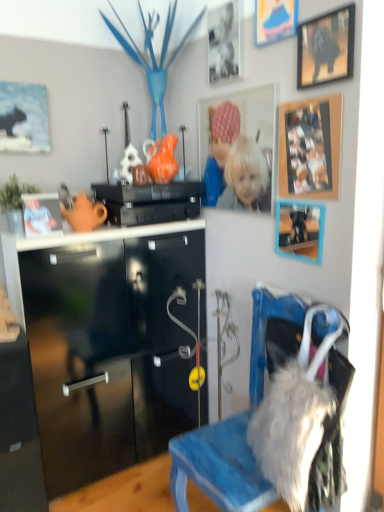
Question: Could you tell me if blue denim chair at lower right is turned towards wooden photo frame at upper center, marked as the fourth picture frame in a right-to-left arrangement?

Choices:
 (A) yes
 (B) no

Answer: (B)

Question: Would you say blue denim chair at lower right contains wooden photo frame at upper center, marked as the fourth picture frame in a right-to-left arrangement?

Choices:
 (A) yes
 (B) no

Answer: (B)

Question: Is blue denim chair at lower right oriented away from wooden photo frame at upper center, marked as the fourth picture frame in a right-to-left arrangement?

Choices:
 (A) yes
 (B) no

Answer: (B)

Question: Can you confirm if blue denim chair at lower right is shorter than wooden photo frame at upper center, placed as the 3th picture frame when sorted from left to right?

Choices:
 (A) yes
 (B) no

Answer: (B)

Question: Is blue denim chair at lower right to the left of wooden photo frame at upper center, marked as the fourth picture frame in a right-to-left arrangement, from the viewer's perspective?

Choices:
 (A) yes
 (B) no

Answer: (B)

Question: Considering the positions of point (253, 166) and point (289, 220), is point (253, 166) closer or farther from the camera than point (289, 220)?

Choices:
 (A) closer
 (B) farther

Answer: (B)

Question: From their relative heights in the image, would you say wooden photo frame at upper center, placed as the 3th picture frame when sorted from left to right, is taller or shorter than wooden picture frame at upper right, which ranks as the 3th picture frame in right-to-left order?

Choices:
 (A) tall
 (B) short

Answer: (A)

Question: Considering their positions, is wooden photo frame at upper center, placed as the 3th picture frame when sorted from left to right, located in front of or behind wooden picture frame at upper right, which ranks as the 3th picture frame in right-to-left order?

Choices:
 (A) behind
 (B) front

Answer: (A)

Question: Is wooden photo frame at upper center, marked as the fourth picture frame in a right-to-left arrangement, wider or thinner than wooden picture frame at upper right, the fourth picture frame in the left-to-right sequence?

Choices:
 (A) thin
 (B) wide

Answer: (A)

Question: In terms of width, does orange glossy vase at center, acting as the second toy starting from the left, look wider or thinner when compared to wooden picture frame at upper right, the fourth picture frame in the left-to-right sequence?

Choices:
 (A) thin
 (B) wide

Answer: (B)

Question: From their relative heights in the image, would you say orange glossy vase at center, the second toy positioned from the front, is taller or shorter than wooden picture frame at upper right, the fourth picture frame in the left-to-right sequence?

Choices:
 (A) short
 (B) tall

Answer: (A)

Question: Is orange glossy vase at center, acting as the second toy starting from the left, inside or outside of wooden picture frame at upper right, the fourth picture frame in the left-to-right sequence?

Choices:
 (A) outside
 (B) inside

Answer: (A)

Question: From the image's perspective, is orange glossy vase at center, acting as the second toy starting from the left, positioned above or below wooden picture frame at upper right, the fourth picture frame in the left-to-right sequence?

Choices:
 (A) below
 (B) above

Answer: (B)

Question: From the image's perspective, is black matte picture frame at upper center, which is the 2th picture frame in left-to-right order, positioned above or below matte orange teapot at upper left, which is the 2th toy in right-to-left order?

Choices:
 (A) above
 (B) below

Answer: (A)

Question: Is point (216, 33) positioned closer to the camera than point (92, 219)?

Choices:
 (A) closer
 (B) farther

Answer: (B)